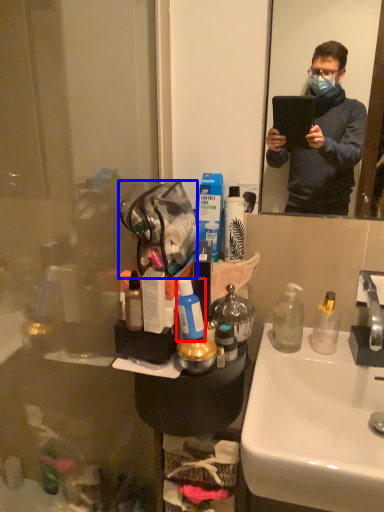
Question: Which point is closer to the camera, toiletries (highlighted by a red box) or handbag (highlighted by a blue box)?

Choices:
 (A) toiletries
 (B) handbag

Answer: (B)